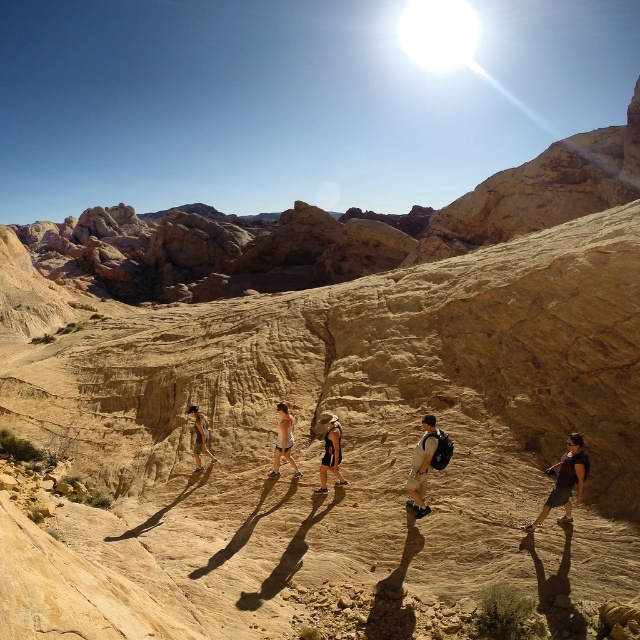
Is orange and black tank top at center shorter than matte black shorts at center?

Incorrect, orange and black tank top at center's height does not fall short of matte black shorts at center's.

Is orange and black tank top at center taller than matte black shorts at center?

Yes.

Which is in front, point (332, 465) or point (211, 460)?

Point (332, 465)

I want to click on orange and black tank top at center, so click(330, 451).

Measure the distance between purple fabric shirt at right and orange and black tank top at center.

The distance of purple fabric shirt at right from orange and black tank top at center is 17.79 meters.

Can you confirm if purple fabric shirt at right is wider than orange and black tank top at center?

Incorrect, purple fabric shirt at right's width does not surpass orange and black tank top at center's.

Who is more forward, (563,499) or (323,416)?

Point (563,499)

At what (x,y) coordinates should I click in order to perform the action: click on purple fabric shirt at right. Please return your answer as a coordinate pair (x, y). Looking at the image, I should click on (564, 481).

Is point (280, 448) closer to camera compared to point (200, 448)?

Yes.

Which is in front, point (273, 464) or point (196, 408)?

Point (273, 464) is more forward.

Is point (280, 452) farther from viewer compared to point (189, 412)?

No.

The height and width of the screenshot is (640, 640). I want to click on tan skin person at center, so click(x=284, y=442).